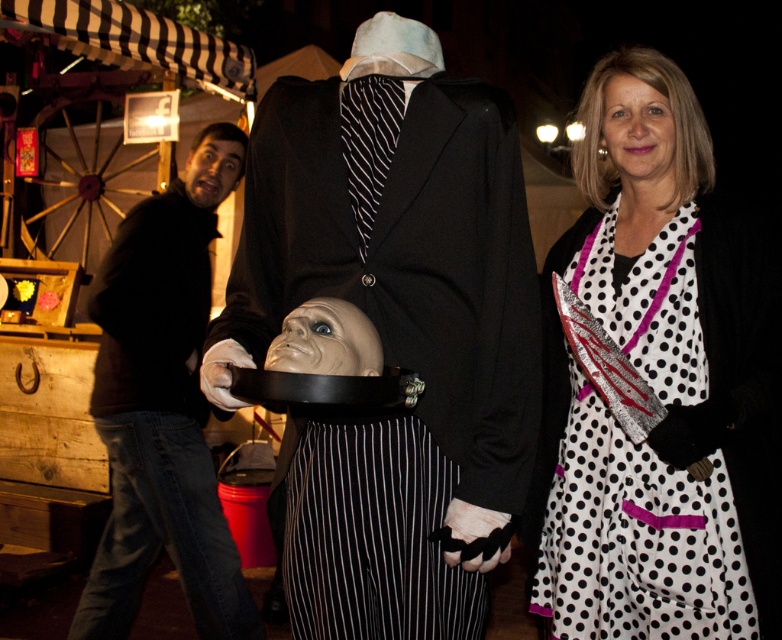
What do you see at coordinates (651, 378) in the screenshot? The height and width of the screenshot is (640, 782). I see `white dotted dress at center` at bounding box center [651, 378].

Between point (630, 230) and point (662, 106), which one is positioned in front?

Point (662, 106) is in front.

Identify the location of white dotted dress at center. The image size is (782, 640). (651, 378).

Who is higher up, white dotted dress at center or smooth plastic mask at center?

white dotted dress at center is higher up.

Who is more forward, (651,438) or (296,364)?

Point (296,364)

Locate an element on the screen. white dotted dress at center is located at coordinates (651, 378).

Which is below, matte black suit at center or smooth plastic mask at center?

smooth plastic mask at center is below.

This screenshot has width=782, height=640. What are the coordinates of `matte black suit at center` in the screenshot? It's located at (393, 332).

Find the location of a particular element. This screenshot has height=640, width=782. matte black suit at center is located at coordinates (393, 332).